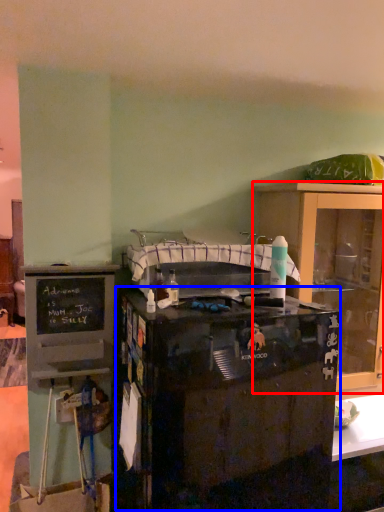
Question: Which object is closer to the camera taking this photo, cabinetry (highlighted by a red box) or desk (highlighted by a blue box)?

Choices:
 (A) cabinetry
 (B) desk

Answer: (B)